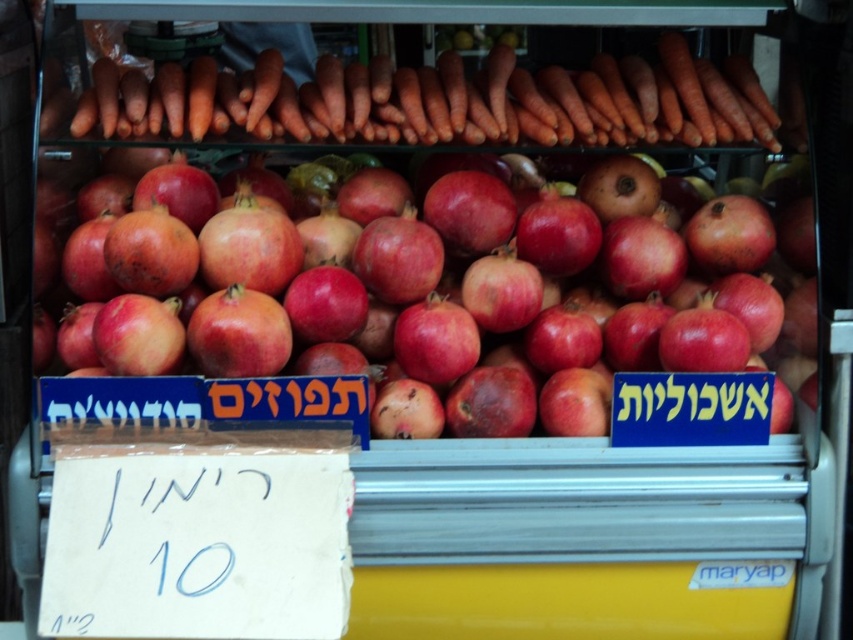
Question: Among these objects, which one is nearest to the camera?

Choices:
 (A) orange smooth carrots at upper center
 (B) shiny red pomegranate at center

Answer: (B)

Question: Can you confirm if shiny red pomegranate at center is positioned to the right of orange smooth carrots at upper center?

Choices:
 (A) no
 (B) yes

Answer: (B)

Question: Does shiny red pomegranate at center have a larger size compared to orange smooth carrots at upper center?

Choices:
 (A) yes
 (B) no

Answer: (A)

Question: Among these objects, which one is farthest from the camera?

Choices:
 (A) orange smooth carrots at upper center
 (B) shiny red pomegranate at center

Answer: (A)

Question: Does shiny red pomegranate at center have a greater width compared to orange smooth carrots at upper center?

Choices:
 (A) no
 (B) yes

Answer: (A)